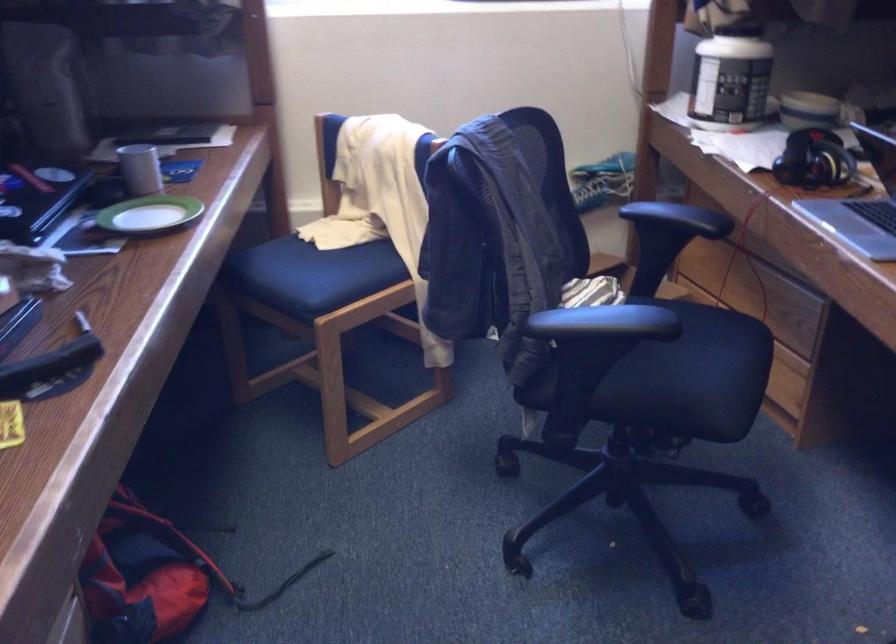
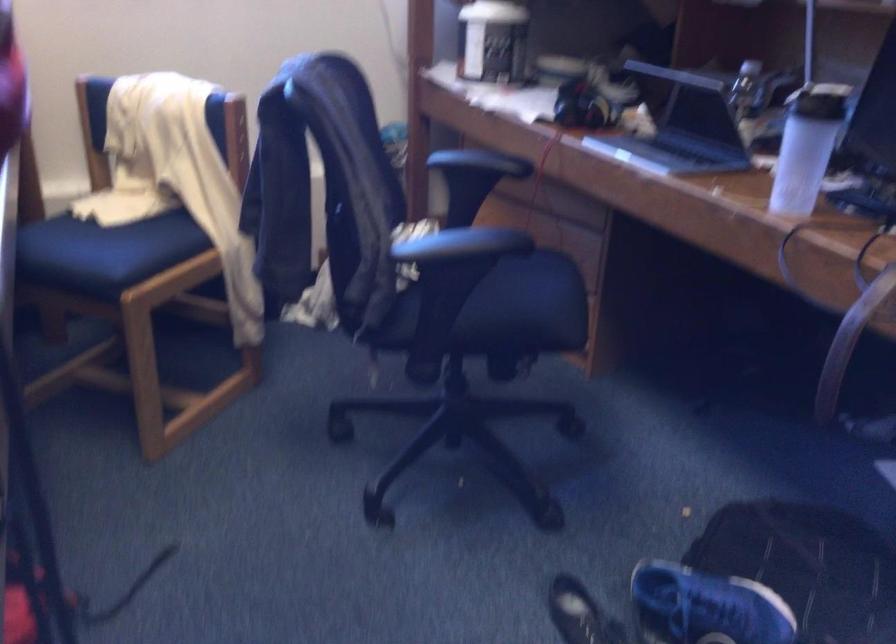
Question: The camera is either moving clockwise (left) or counter-clockwise (right) around the object. The first image is from the beginning of the video and the second image is from the end. Is the camera moving left or right when shooting the video?

Choices:
 (A) Left
 (B) Right

Answer: (A)